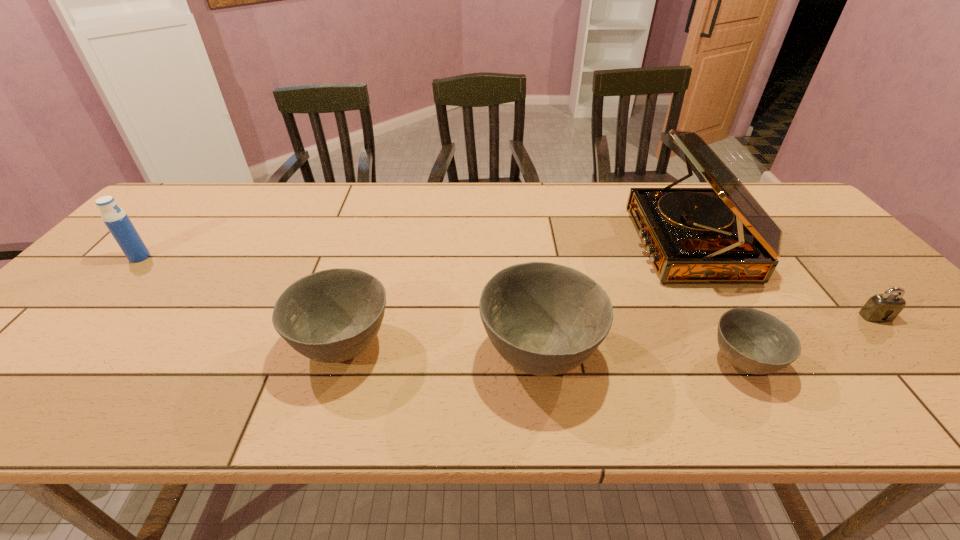
Locate an element on the screen. The height and width of the screenshot is (540, 960). vacant point located on the back of the shortest bowl is located at coordinates (715, 313).

Locate an element on the screen. Image resolution: width=960 pixels, height=540 pixels. vacant space situated at the front of the rightmost object near the keyhole is located at coordinates [x=913, y=357].

Locate an element on the screen. vacant space located 0.060m on the front-facing side of the record player is located at coordinates (615, 244).

You are a GUI agent. You are given a task and a screenshot of the screen. Output one action in this format:
    pyautogui.click(x=<x>, y=<y>)
    Task: Click on the vacant space located 0.140m on the front-facing side of the record player
    This screenshot has height=540, width=960.
    Given the screenshot: What is the action you would take?
    pyautogui.click(x=587, y=244)

The width and height of the screenshot is (960, 540). I want to click on vacant space located 0.140m on the front-facing side of the record player, so click(x=587, y=244).

This screenshot has height=540, width=960. Identify the location of vacant region located 0.060m on the back of the fifth shortest object. (x=156, y=239).

Where is `object situated at the far edge`? Image resolution: width=960 pixels, height=540 pixels. object situated at the far edge is located at coordinates (722, 234).

I want to click on object that is at the left edge, so click(115, 218).

Image resolution: width=960 pixels, height=540 pixels. In order to click on object located at the right edge in this screenshot , I will do `click(880, 308)`.

Where is `vacant space at the far edge of the desktop`? vacant space at the far edge of the desktop is located at coordinates (551, 193).